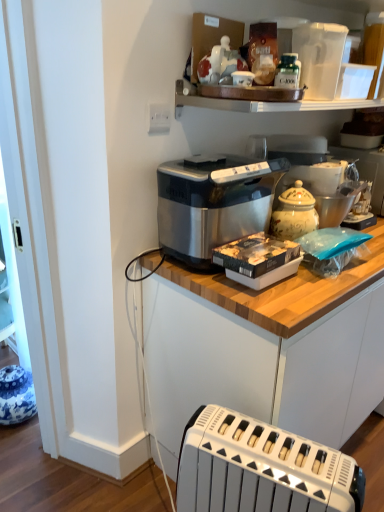
Question: Visually, is satin silver toaster at center positioned to the left or to the right of green glass bottle at upper center?

Choices:
 (A) right
 (B) left

Answer: (A)

Question: Looking at the image, does satin silver toaster at center seem bigger or smaller compared to green glass bottle at upper center?

Choices:
 (A) small
 (B) big

Answer: (B)

Question: Which object is positioned farthest from the satin silver toaster at center?

Choices:
 (A) white plastic electric outlet at upper center
 (B) satin metallic bread maker at center
 (C) white plastic toaster at lower center
 (D) green glass bottle at upper center
 (E) blue and white ceramic vase at lower left, which appears as the 1th appliance when ordered from the bottom

Answer: (E)

Question: Based on their relative distances, which object is nearer to the white plastic pitcher at upper right, which is the 3th appliance in bottom-to-top order?

Choices:
 (A) blue and white ceramic vase at lower left, acting as the third appliance starting from the top
 (B) white ceramic jar at upper right, which is counted as the first appliance, starting from the right
 (C) green glass bottle at upper center
 (D) white plastic toaster at lower center
 (E) satin metallic bread maker at center

Answer: (C)